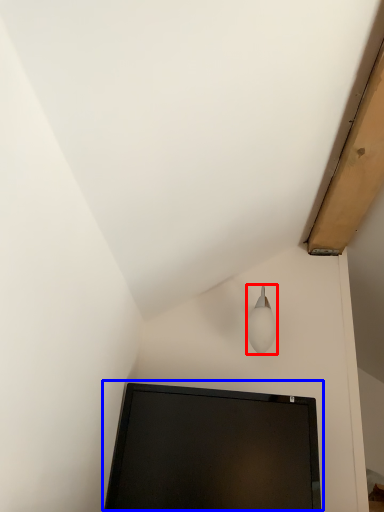
Question: Among these objects, which one is farthest to the camera, lamp (highlighted by a red box) or computer monitor (highlighted by a blue box)?

Choices:
 (A) lamp
 (B) computer monitor

Answer: (A)